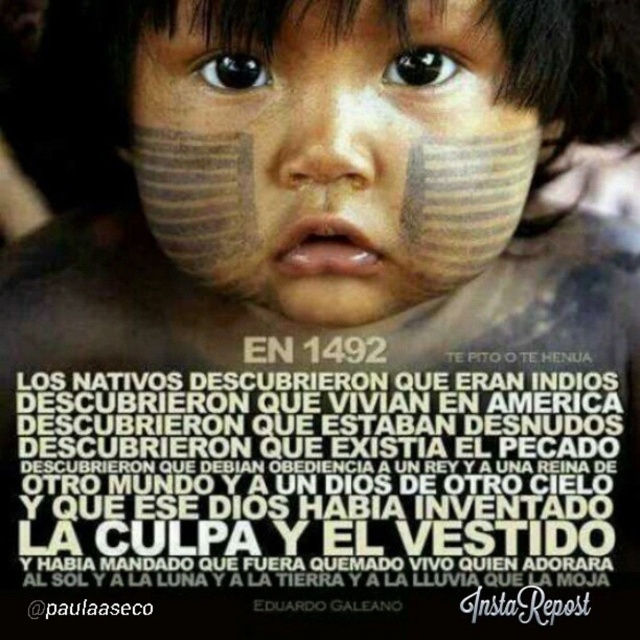
Question: Estimate the real-world distances between objects in this image. Which object is farther from the matte skin forehead at upper center?

Choices:
 (A) matte clay face at center
 (B) white paper text at center

Answer: (B)

Question: Does white paper text at center have a greater width compared to matte clay face at center?

Choices:
 (A) yes
 (B) no

Answer: (A)

Question: Which object is the farthest from the matte clay face at center?

Choices:
 (A) matte skin forehead at upper center
 (B) white paper text at center

Answer: (B)

Question: Where is white paper text at center located in relation to matte clay face at center in the image?

Choices:
 (A) below
 (B) above

Answer: (A)

Question: Is white paper text at center further to camera compared to matte skin forehead at upper center?

Choices:
 (A) yes
 (B) no

Answer: (A)

Question: Which of the following is the farthest from the observer?

Choices:
 (A) matte clay face at center
 (B) white paper text at center

Answer: (B)